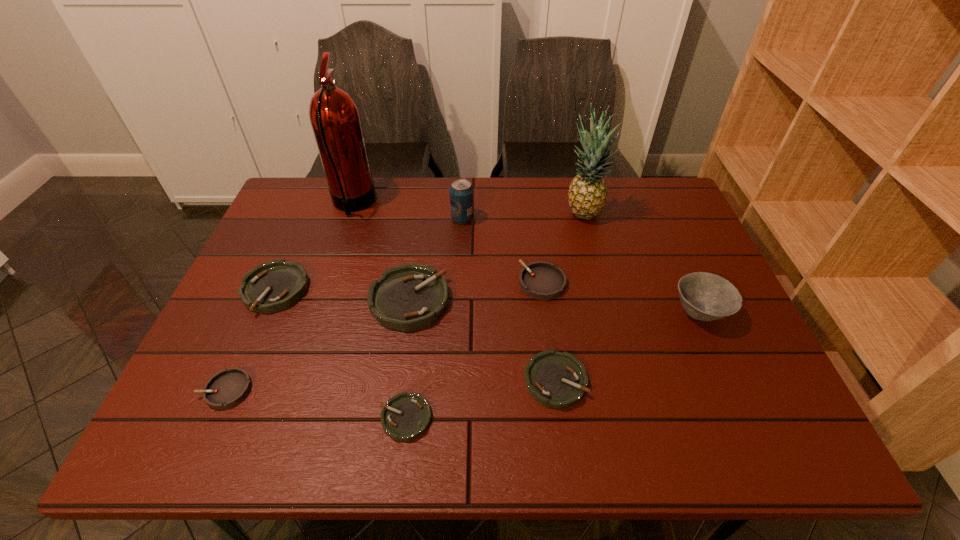
Locate an element on the screen. This screenshot has width=960, height=540. fire extinguisher located in the left edge section of the desktop is located at coordinates (334, 116).

I want to click on object that is positioned at the right edge, so click(x=704, y=296).

Where is `object that is at the far left corner`? object that is at the far left corner is located at coordinates (334, 116).

Find the location of `blank space at the far edge of the desktop`. blank space at the far edge of the desktop is located at coordinates (342, 215).

The height and width of the screenshot is (540, 960). Identify the location of vacant space at the near edge. (488, 423).

Where is `free region at the left edge`? free region at the left edge is located at coordinates (300, 226).

Locate an element on the screen. The width and height of the screenshot is (960, 540). vacant space at the right edge of the desktop is located at coordinates (702, 346).

In the image, there is a desktop. Where is `vacant region at the far left corner`? vacant region at the far left corner is located at coordinates (321, 185).

Where is `vacant space that is in between the rightmost green ashtray and the tallest object`? vacant space that is in between the rightmost green ashtray and the tallest object is located at coordinates (454, 292).

Locate an element on the screen. vacant space that is in between the fire extinguisher and the leftmost green ashtray is located at coordinates (314, 247).